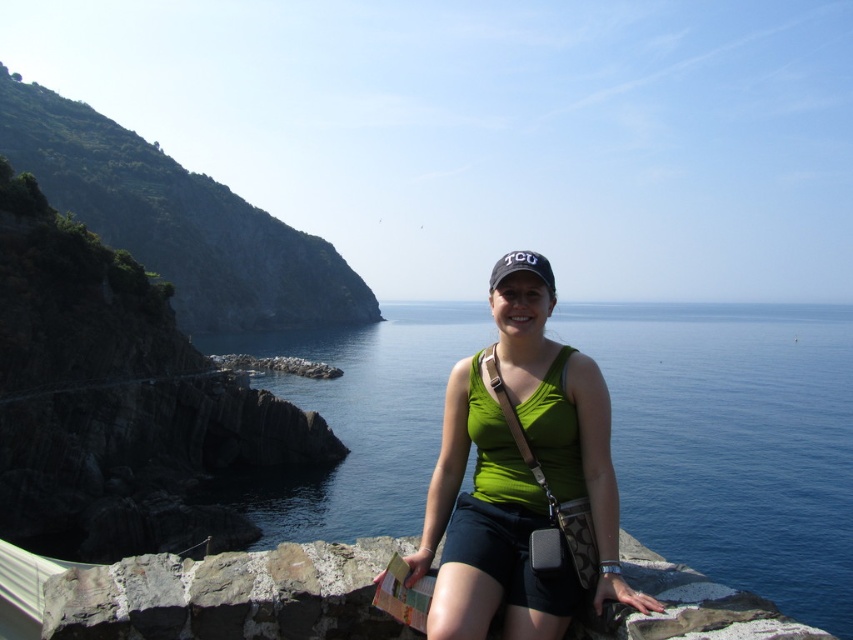
Question: Based on their relative distances, which object is nearer to the green fabric tank top at center?

Choices:
 (A) rough textured stone at lower left
 (B) blue water at center

Answer: (A)

Question: Is green fabric tank top at center smaller than green rocky cliff at left?

Choices:
 (A) yes
 (B) no

Answer: (A)

Question: In this image, where is green fabric tank top at center located relative to green rocky cliff at left?

Choices:
 (A) above
 (B) below

Answer: (B)

Question: Estimate the real-world distances between objects in this image. Which object is farther from the green rocky cliff at left?

Choices:
 (A) green fabric tank top at center
 (B) blue water at center
 (C) rough textured stone at lower left

Answer: (C)

Question: Does green fabric tank top at center appear on the left side of rough textured stone at lower left?

Choices:
 (A) no
 (B) yes

Answer: (A)

Question: Estimate the real-world distances between objects in this image. Which object is closer to the green rocky cliff at left?

Choices:
 (A) green fabric tank top at center
 (B) rough textured stone at lower left

Answer: (A)